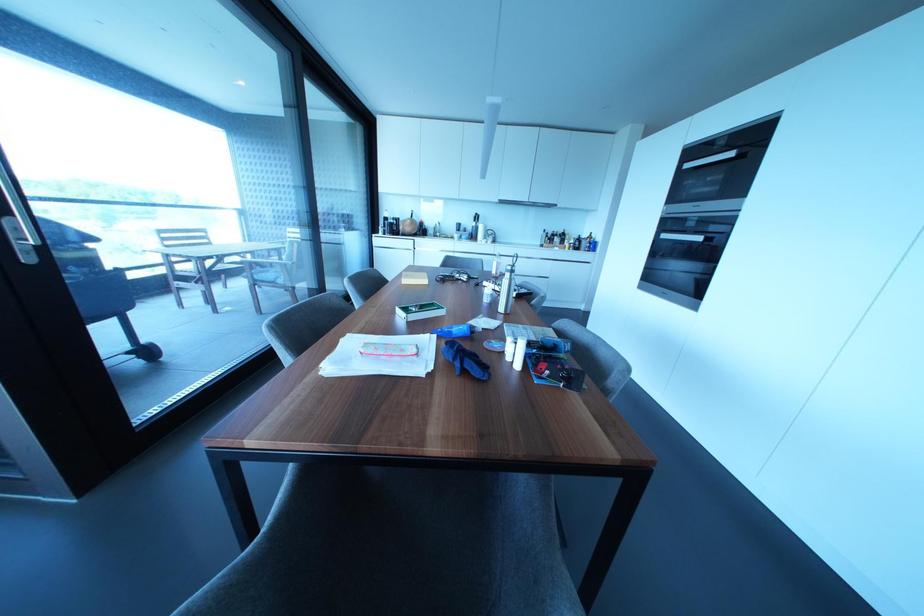
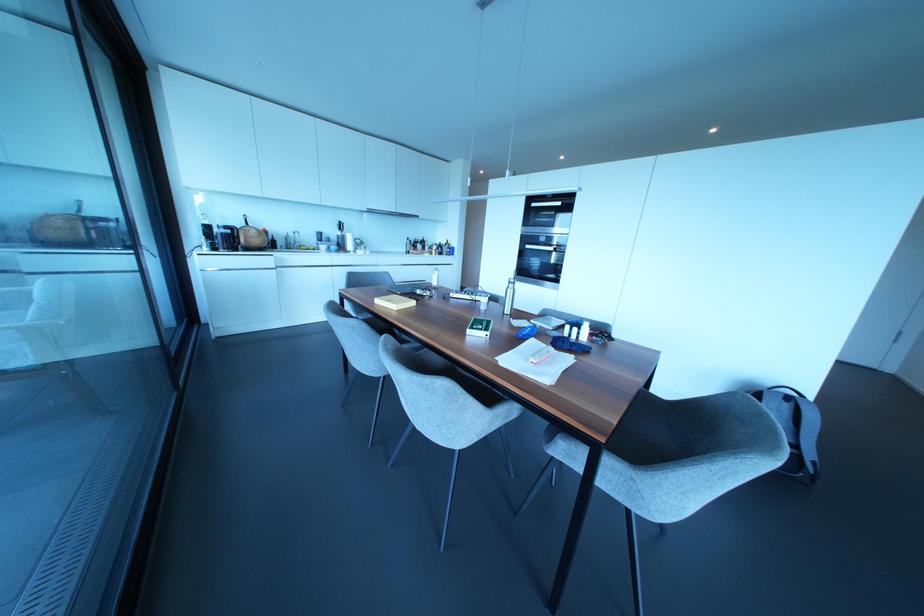
The point at (501, 201) is marked in the first image. Where is the corresponding point in the second image?

(370, 209)